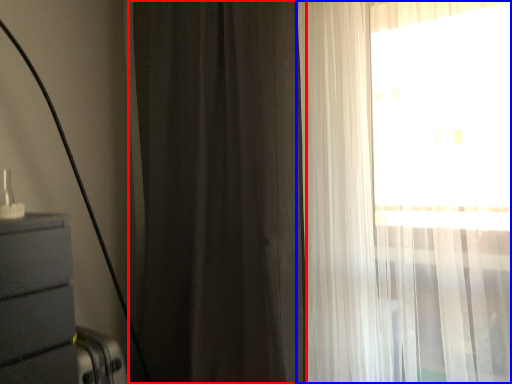
Question: Which object appears closest to the camera in this image, curtain (highlighted by a red box) or curtain (highlighted by a blue box)?

Choices:
 (A) curtain
 (B) curtain

Answer: (B)